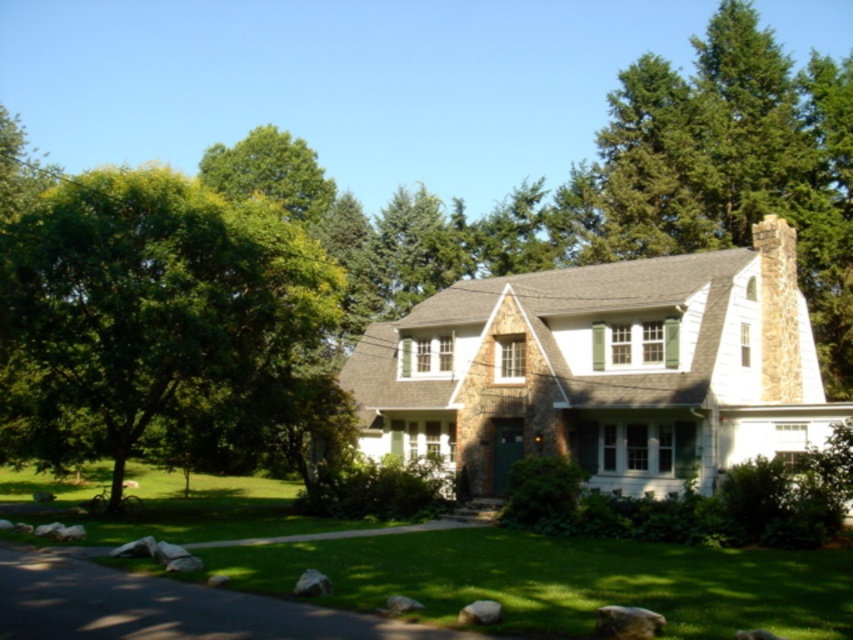
You are planning to plant a new flower bed in your garden. You want to ensure that the flowers will get enough sunlight. Considering the green leafy tree at left and the green grass at center, which area would be better for planting the flowers?

The green grass at center would be better for planting flowers since the green leafy tree at left is much taller and might block sunlight.

You are standing at the front door of the house and want to go to the point marked at coordinates point [216,301]. Which direction should you walk relative to the point marked at coordinates point [851,634]?

You should walk towards the point marked at coordinates point [216,301], which is behind the point marked at coordinates point [851,634] from your current position at the front door.

You are planning to plant a new tree in your backyard. The space you have is narrow. You want to choose between the green leafy tree at left and the green grass at center. Which one would be better suited for the narrow space?

The green leafy tree at left has a lesser width compared to green grass at center, so it would be better suited for the narrow space.